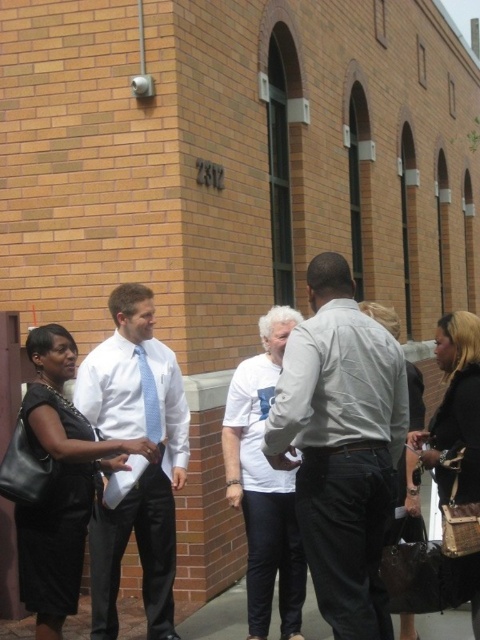
Does white shirt and tie at center lie in front of white matte t-shirt at center?

Yes.

Does white shirt and tie at center appear on the right side of white matte t-shirt at center?

No, white shirt and tie at center is not to the right of white matte t-shirt at center.

Between point (149, 380) and point (284, 472), which one is positioned in front?

Positioned in front is point (284, 472).

Locate an element on the screen. white shirt and tie at center is located at coordinates (148, 460).

Can you confirm if black leather jacket at lower right is smaller than matte black purse at center?

No.

Between black leather jacket at lower right and matte black purse at center, which one appears on the right side from the viewer's perspective?

black leather jacket at lower right is more to the right.

Find the location of a particular element. The width and height of the screenshot is (480, 640). black leather jacket at lower right is located at coordinates (454, 412).

The image size is (480, 640). Find the location of `black leather jacket at lower right`. black leather jacket at lower right is located at coordinates (454, 412).

Which is behind, point (259, 467) or point (418, 433)?

The point (259, 467) is more distant.

Looking at this image, how much distance is there between white matte t-shirt at center and black leather jacket at lower right?

white matte t-shirt at center is 3.79 feet from black leather jacket at lower right.

Between point (277, 308) and point (437, 358), which one is positioned in front?

Point (437, 358) is more forward.

You are a GUI agent. You are given a task and a screenshot of the screen. Output one action in this format:
    pyautogui.click(x=<x>, y=<y>)
    Task: Click on the white matte t-shirt at center
    The image size is (480, 640).
    Given the screenshot: What is the action you would take?
    pyautogui.click(x=264, y=484)